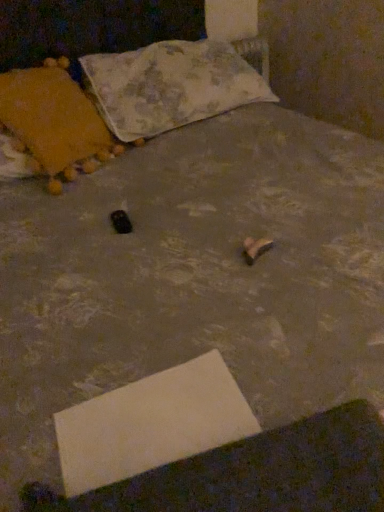
This screenshot has height=512, width=384. Find the location of `fluffy fabric pillow at upper center, placed as the first pillow when sorted from right to left`. fluffy fabric pillow at upper center, placed as the first pillow when sorted from right to left is located at coordinates [170, 86].

The width and height of the screenshot is (384, 512). In order to click on velvet orange pillow at left, acting as the 1th pillow starting from the left in this screenshot , I will do `click(53, 123)`.

How much space does velvet orange pillow at left, placed as the second pillow when sorted from right to left, occupy horizontally?

It is 15.41 inches.

What do you see at coordinates (151, 424) in the screenshot? The image size is (384, 512). I see `white cardboard at lower center` at bounding box center [151, 424].

The image size is (384, 512). What are the coordinates of `fluffy fabric pillow at upper center, placed as the first pillow when sorted from right to left` in the screenshot? It's located at (170, 86).

Is white cardboard at lower center situated inside fluffy fabric pillow at upper center, the second pillow from the left, or outside?

white cardboard at lower center exists outside the volume of fluffy fabric pillow at upper center, the second pillow from the left.

Is white cardboard at lower center turned away from fluffy fabric pillow at upper center, the second pillow from the left?

No, white cardboard at lower center is not facing away from fluffy fabric pillow at upper center, the second pillow from the left.

Considering the positions of objects white cardboard at lower center and fluffy fabric pillow at upper center, placed as the first pillow when sorted from right to left, in the image provided, who is more to the left, white cardboard at lower center or fluffy fabric pillow at upper center, placed as the first pillow when sorted from right to left,?

From the viewer's perspective, white cardboard at lower center appears more on the left side.

From a real-world perspective, who is located lower, white cardboard at lower center or fluffy fabric pillow at upper center, the second pillow from the left?

white cardboard at lower center.

Is point (38, 72) closer to camera compared to point (119, 92)?

Yes.

How many degrees apart are the facing directions of velvet orange pillow at left, placed as the second pillow when sorted from right to left, and fluffy fabric pillow at upper center, placed as the first pillow when sorted from right to left?

0.602 degrees.

Measure the distance between velvet orange pillow at left, acting as the 1th pillow starting from the left, and fluffy fabric pillow at upper center, placed as the first pillow when sorted from right to left.

They are 10.52 inches apart.

Which object is further away from the camera taking this photo, velvet orange pillow at left, acting as the 1th pillow starting from the left, or fluffy fabric pillow at upper center, placed as the first pillow when sorted from right to left?

fluffy fabric pillow at upper center, placed as the first pillow when sorted from right to left.

Is white cardboard at lower center touching velvet orange pillow at left, placed as the second pillow when sorted from right to left?

No, white cardboard at lower center is not making contact with velvet orange pillow at left, placed as the second pillow when sorted from right to left.

Does white cardboard at lower center appear on the left side of velvet orange pillow at left, acting as the 1th pillow starting from the left?

No, white cardboard at lower center is not to the left of velvet orange pillow at left, acting as the 1th pillow starting from the left.

Does white cardboard at lower center have a lesser width compared to velvet orange pillow at left, acting as the 1th pillow starting from the left?

Indeed, white cardboard at lower center has a lesser width compared to velvet orange pillow at left, acting as the 1th pillow starting from the left.

In the scene shown: Could you measure the distance between white cardboard at lower center and velvet orange pillow at left, acting as the 1th pillow starting from the left?

The distance of white cardboard at lower center from velvet orange pillow at left, acting as the 1th pillow starting from the left, is 36.69 inches.

From the picture: How many degrees apart are the facing directions of velvet orange pillow at left, acting as the 1th pillow starting from the left, and white cardboard at lower center?

They differ by 16.1 degrees in their facing directions.

Measure the distance between velvet orange pillow at left, acting as the 1th pillow starting from the left, and white cardboard at lower center.

A distance of 36.69 inches exists between velvet orange pillow at left, acting as the 1th pillow starting from the left, and white cardboard at lower center.

In the scene shown: From the image's perspective, is velvet orange pillow at left, placed as the second pillow when sorted from right to left, located above white cardboard at lower center?

Yes, from the image's perspective, velvet orange pillow at left, placed as the second pillow when sorted from right to left, is on top of white cardboard at lower center.

Considering the sizes of objects velvet orange pillow at left, placed as the second pillow when sorted from right to left, and white cardboard at lower center in the image provided, who is taller, velvet orange pillow at left, placed as the second pillow when sorted from right to left, or white cardboard at lower center?

velvet orange pillow at left, placed as the second pillow when sorted from right to left, is taller.

Based on the photo, is fluffy fabric pillow at upper center, placed as the first pillow when sorted from right to left, oriented away from velvet orange pillow at left, placed as the second pillow when sorted from right to left?

No, fluffy fabric pillow at upper center, placed as the first pillow when sorted from right to left, is not facing the opposite direction of velvet orange pillow at left, placed as the second pillow when sorted from right to left.

Can you confirm if fluffy fabric pillow at upper center, placed as the first pillow when sorted from right to left, is bigger than velvet orange pillow at left, placed as the second pillow when sorted from right to left?

Indeed, fluffy fabric pillow at upper center, placed as the first pillow when sorted from right to left, has a larger size compared to velvet orange pillow at left, placed as the second pillow when sorted from right to left.

Identify the location of pillow that appears on the left of fluffy fabric pillow at upper center, the second pillow from the left. This screenshot has height=512, width=384. (53, 123).

From the picture: From a real-world perspective, is fluffy fabric pillow at upper center, the second pillow from the left, beneath velvet orange pillow at left, acting as the 1th pillow starting from the left?

Indeed, from a real-world perspective, fluffy fabric pillow at upper center, the second pillow from the left, is positioned beneath velvet orange pillow at left, acting as the 1th pillow starting from the left.

From the picture: Does fluffy fabric pillow at upper center, the second pillow from the left, have a larger size compared to white cardboard at lower center?

Yes.

Does fluffy fabric pillow at upper center, the second pillow from the left, have a greater width compared to white cardboard at lower center?

Yes.

Considering the relative positions of fluffy fabric pillow at upper center, the second pillow from the left, and white cardboard at lower center in the image provided, is fluffy fabric pillow at upper center, the second pillow from the left, behind white cardboard at lower center?

Yes, fluffy fabric pillow at upper center, the second pillow from the left, is behind white cardboard at lower center.

Can white cardboard at lower center be found inside fluffy fabric pillow at upper center, placed as the first pillow when sorted from right to left?

That's incorrect, white cardboard at lower center is not inside fluffy fabric pillow at upper center, placed as the first pillow when sorted from right to left.

Locate an element on the screen. Image resolution: width=384 pixels, height=512 pixels. the 2nd pillow above the white cardboard at lower center (from the image's perspective) is located at coordinates (170, 86).

Where is `pillow lying in front of the fluffy fabric pillow at upper center, placed as the first pillow when sorted from right to left`? Image resolution: width=384 pixels, height=512 pixels. pillow lying in front of the fluffy fabric pillow at upper center, placed as the first pillow when sorted from right to left is located at coordinates (53, 123).

Estimate the real-world distances between objects in this image. Which object is closer to white cardboard at lower center, fluffy fabric pillow at upper center, the second pillow from the left, or velvet orange pillow at left, placed as the second pillow when sorted from right to left?

The object closer to white cardboard at lower center is velvet orange pillow at left, placed as the second pillow when sorted from right to left.

Considering their positions, is white cardboard at lower center positioned closer to velvet orange pillow at left, acting as the 1th pillow starting from the left, than fluffy fabric pillow at upper center, the second pillow from the left?

fluffy fabric pillow at upper center, the second pillow from the left, is positioned closer to the anchor velvet orange pillow at left, acting as the 1th pillow starting from the left.

Considering their positions, is white cardboard at lower center positioned further to fluffy fabric pillow at upper center, placed as the first pillow when sorted from right to left, than velvet orange pillow at left, acting as the 1th pillow starting from the left?

white cardboard at lower center.

Based on their spatial positions, is velvet orange pillow at left, placed as the second pillow when sorted from right to left, or white cardboard at lower center further from fluffy fabric pillow at upper center, the second pillow from the left?

white cardboard at lower center is positioned further to the anchor fluffy fabric pillow at upper center, the second pillow from the left.

When comparing their distances from white cardboard at lower center, does velvet orange pillow at left, acting as the 1th pillow starting from the left, or fluffy fabric pillow at upper center, placed as the first pillow when sorted from right to left, seem further?

fluffy fabric pillow at upper center, placed as the first pillow when sorted from right to left, lies further to white cardboard at lower center than the other object.

Based on their spatial positions, is fluffy fabric pillow at upper center, the second pillow from the left, or white cardboard at lower center further from velvet orange pillow at left, placed as the second pillow when sorted from right to left?

Based on the image, white cardboard at lower center appears to be further to velvet orange pillow at left, placed as the second pillow when sorted from right to left.

The image size is (384, 512). I want to click on pillow that lies between fluffy fabric pillow at upper center, the second pillow from the left, and white cardboard at lower center from top to bottom, so click(x=53, y=123).